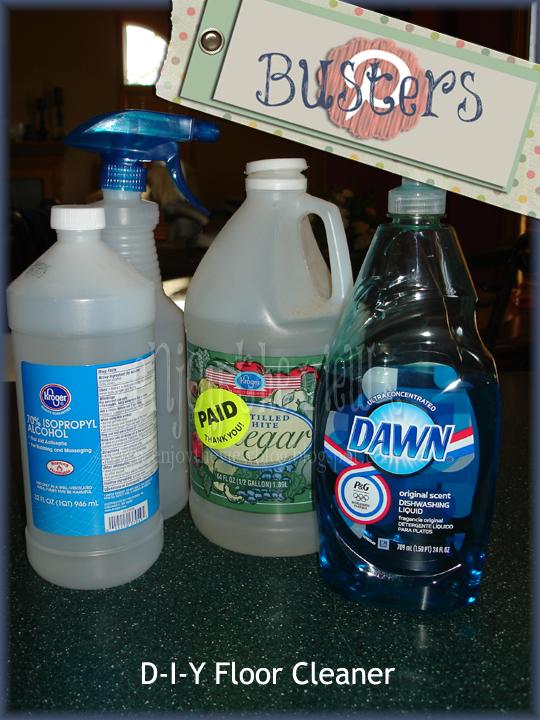
The height and width of the screenshot is (720, 540). Identify the location of window. (143, 54).